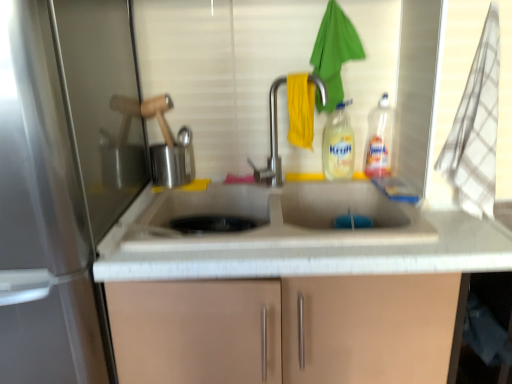
Question: Can you confirm if satin nickel faucet at center is shorter than yellow translucent liquid at center, the 1th bottle positioned from the left?

Choices:
 (A) no
 (B) yes

Answer: (A)

Question: Does satin nickel faucet at center come behind yellow translucent liquid at center, the second bottle positioned from the right?

Choices:
 (A) yes
 (B) no

Answer: (B)

Question: From a real-world perspective, is satin nickel faucet at center physically below yellow translucent liquid at center, the second bottle positioned from the right?

Choices:
 (A) yes
 (B) no

Answer: (B)

Question: Is satin nickel faucet at center facing away from yellow translucent liquid at center, the second bottle positioned from the right?

Choices:
 (A) yes
 (B) no

Answer: (B)

Question: Is satin nickel faucet at center far away from yellow translucent liquid at center, the second bottle positioned from the right?

Choices:
 (A) yes
 (B) no

Answer: (B)

Question: In terms of width, does yellow translucent liquid at center, the second bottle positioned from the right, look wider or thinner when compared to brushed metal kettle at upper left?

Choices:
 (A) thin
 (B) wide

Answer: (A)

Question: From a real-world perspective, is yellow translucent liquid at center, the second bottle positioned from the right, physically located above or below brushed metal kettle at upper left?

Choices:
 (A) above
 (B) below

Answer: (A)

Question: In terms of height, does yellow translucent liquid at center, the 1th bottle positioned from the left, look taller or shorter compared to brushed metal kettle at upper left?

Choices:
 (A) tall
 (B) short

Answer: (A)

Question: Considering the positions of yellow translucent liquid at center, the second bottle positioned from the right, and brushed metal kettle at upper left in the image, is yellow translucent liquid at center, the second bottle positioned from the right, bigger or smaller than brushed metal kettle at upper left?

Choices:
 (A) small
 (B) big

Answer: (A)

Question: Is satin nickel faucet at center wider or thinner than translucent plastic bottle at upper right, marked as the second bottle in a left-to-right arrangement?

Choices:
 (A) thin
 (B) wide

Answer: (B)

Question: From the image's perspective, is satin nickel faucet at center located above or below translucent plastic bottle at upper right, marked as the second bottle in a left-to-right arrangement?

Choices:
 (A) above
 (B) below

Answer: (B)

Question: Do you think satin nickel faucet at center is within translucent plastic bottle at upper right, marked as the second bottle in a left-to-right arrangement, or outside of it?

Choices:
 (A) inside
 (B) outside

Answer: (B)

Question: From a real-world perspective, is satin nickel faucet at center above or below translucent plastic bottle at upper right, marked as the second bottle in a left-to-right arrangement?

Choices:
 (A) above
 (B) below

Answer: (A)

Question: From a real-world perspective, is translucent plastic bottle at upper right, marked as the second bottle in a left-to-right arrangement, physically located above or below satin nickel faucet at center?

Choices:
 (A) above
 (B) below

Answer: (B)

Question: In terms of height, does translucent plastic bottle at upper right, positioned as the first bottle in right-to-left order, look taller or shorter compared to satin nickel faucet at center?

Choices:
 (A) tall
 (B) short

Answer: (B)